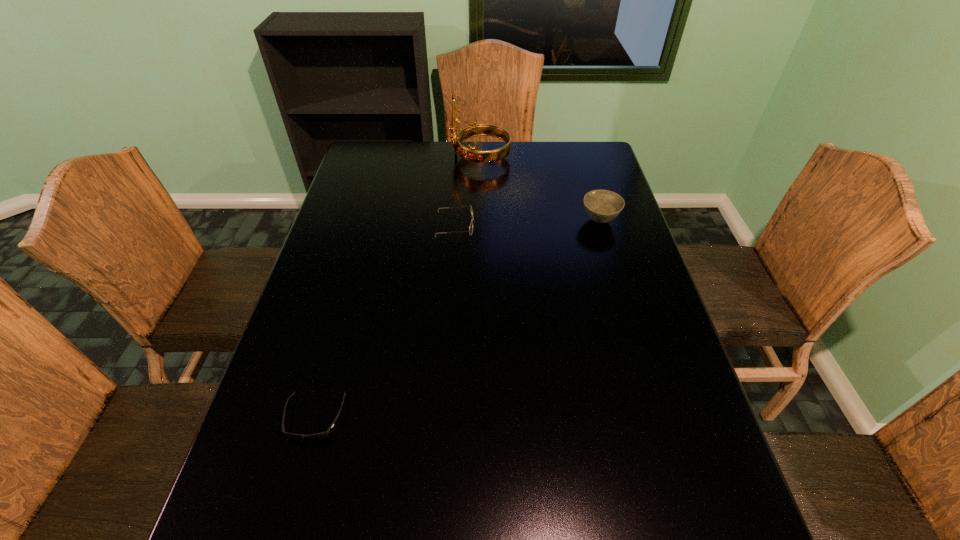
Identify the location of vacant space at the far right corner of the desktop. (588, 145).

Locate an element on the screen. The height and width of the screenshot is (540, 960). free point between the farthest object and the leftmost object is located at coordinates (397, 287).

Find the location of a particular element. free space between the tiara and the second shortest object is located at coordinates (468, 191).

Identify the location of vacant space in between the spectacles and the tallest object. The height and width of the screenshot is (540, 960). (468, 191).

In order to click on vacant area that lies between the spectacles and the rightmost object in this screenshot , I will do `click(527, 222)`.

At what (x,y) coordinates should I click in order to perform the action: click on free point between the spectacles and the third shortest object. Please return your answer as a coordinate pair (x, y). The width and height of the screenshot is (960, 540). Looking at the image, I should click on (527, 222).

I want to click on free spot between the shortest object and the spectacles, so click(x=385, y=321).

The width and height of the screenshot is (960, 540). Find the location of `vacant area that lies between the shortest object and the spectacles`. vacant area that lies between the shortest object and the spectacles is located at coordinates (385, 321).

The image size is (960, 540). In order to click on free spot between the nearest object and the second tallest object in this screenshot , I will do `click(457, 319)`.

At what (x,y) coordinates should I click in order to perform the action: click on free space between the third tallest object and the tallest object. Please return your answer as a coordinate pair (x, y). Looking at the image, I should click on click(x=468, y=191).